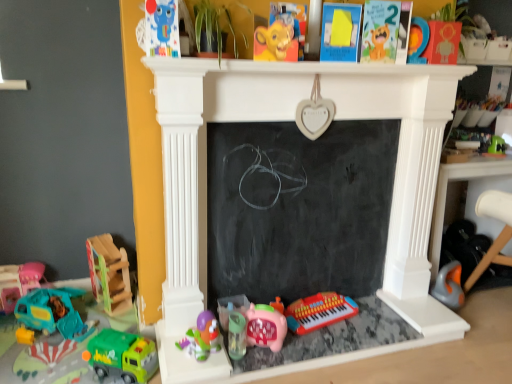
I want to click on free location in front of plastic red keyboard at lower center, which ranks as the 4th toy in right-to-left order, so click(322, 342).